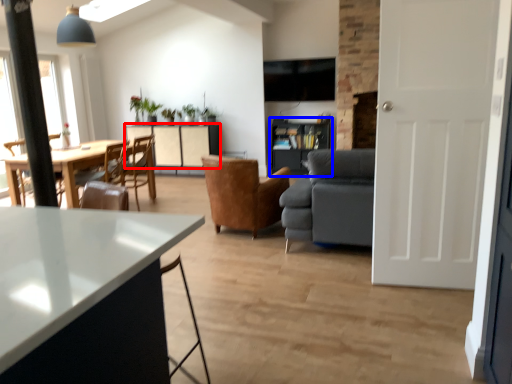
Question: Which object is further to the camera taking this photo, cabinetry (highlighted by a red box) or shelf (highlighted by a blue box)?

Choices:
 (A) cabinetry
 (B) shelf

Answer: (A)